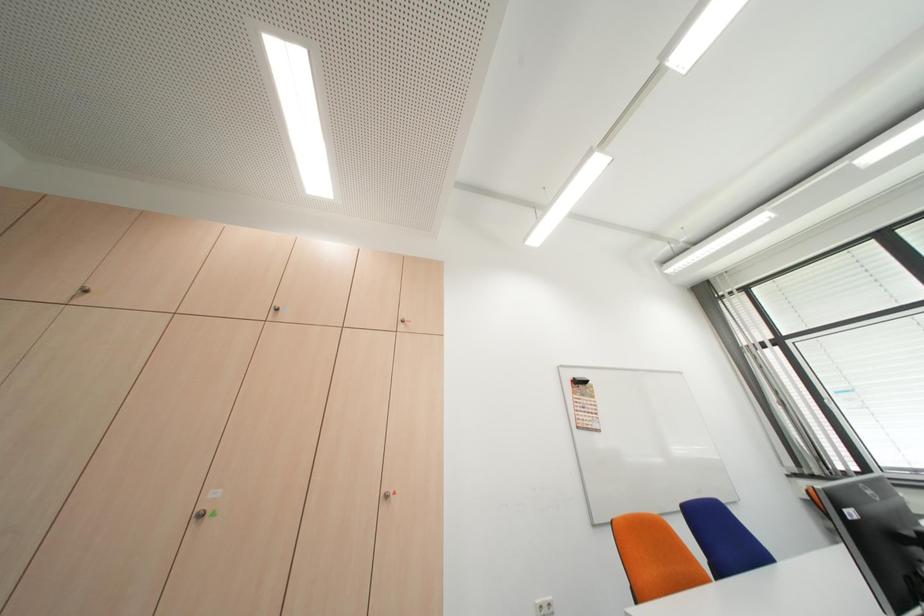
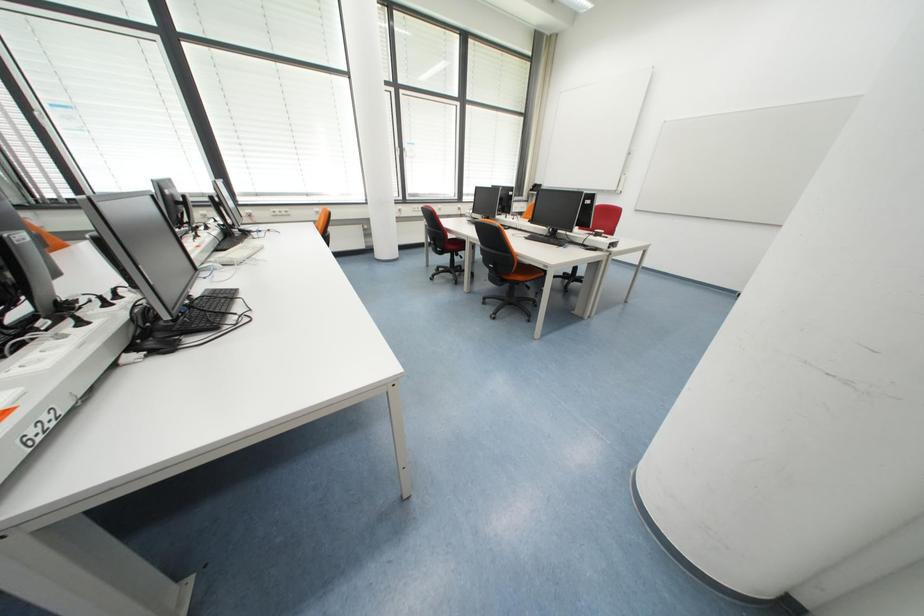
Based on the photo, how did the camera likely rotate?

The camera's rotation is toward right-down.